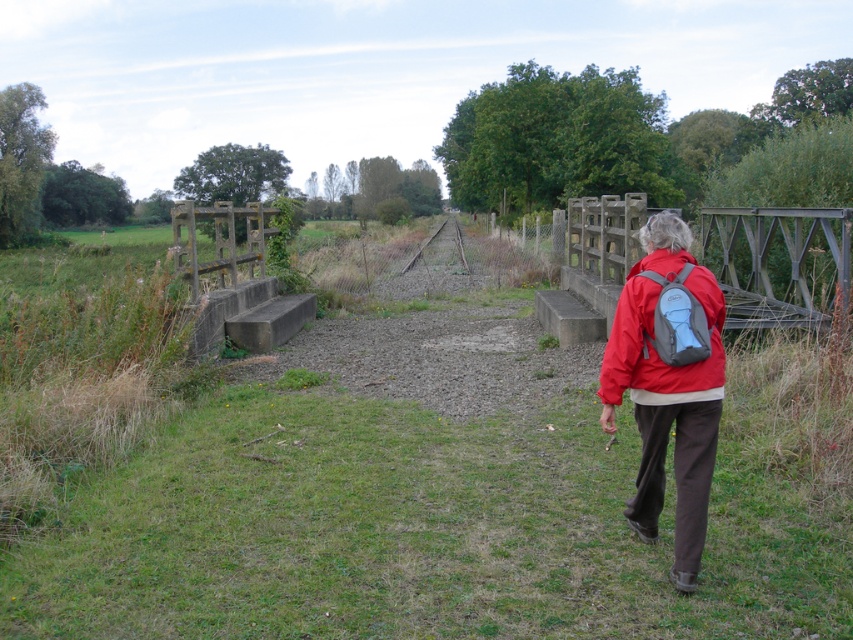
Who is more distant from viewer, (694, 580) or (709, 300)?

The point (709, 300) is more distant.

Does red nylon jacket at center have a larger size compared to red matte jacket at lower right?

Yes, red nylon jacket at center is bigger than red matte jacket at lower right.

You are a GUI agent. You are given a task and a screenshot of the screen. Output one action in this format:
    pyautogui.click(x=<x>, y=<y>)
    Task: Click on the red nylon jacket at center
    
    Given the screenshot: What is the action you would take?
    tap(668, 385)

Does gray fabric backpack at right have a smaller size compared to rusty metal train track at center?

Correct, gray fabric backpack at right occupies less space than rusty metal train track at center.

Consider the image. Measure the distance between gray fabric backpack at right and camera.

11.66 feet

I want to click on gray fabric backpack at right, so click(x=677, y=321).

This screenshot has width=853, height=640. What are the coordinates of `gray fabric backpack at right` in the screenshot? It's located at 677,321.

Which of these two, red matte jacket at lower right or gray fabric backpack at right, stands shorter?

With less height is gray fabric backpack at right.

Consider the image. Is the position of red matte jacket at lower right more distant than that of gray fabric backpack at right?

Yes, red matte jacket at lower right is further from the viewer.

This screenshot has height=640, width=853. What do you see at coordinates (653, 333) in the screenshot?
I see `red matte jacket at lower right` at bounding box center [653, 333].

Locate an element on the screen. Image resolution: width=853 pixels, height=640 pixels. red matte jacket at lower right is located at coordinates (653, 333).